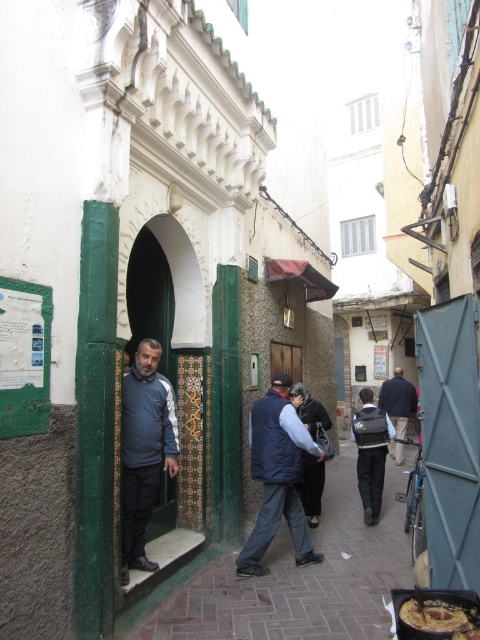
Question: Estimate the real-world distances between objects in this image. Which object is farther from the matte blue jacket at center?

Choices:
 (A) brick pavement at center
 (B) blue down vest at center

Answer: (A)

Question: Which object is the farthest from the dark blue jacket at center?

Choices:
 (A) brick pavement at center
 (B) matte blue jacket at center
 (C) blue down vest at center

Answer: (A)

Question: Observing the image, what is the correct spatial positioning of matte blue jacket at center in reference to dark blue jacket at center?

Choices:
 (A) left
 (B) right

Answer: (A)

Question: Does matte blue jacket at center appear over shiny brown bread at center?

Choices:
 (A) no
 (B) yes

Answer: (B)

Question: Which point is farther to the camera?

Choices:
 (A) (402, 408)
 (B) (385, 588)
 (C) (154, 406)
 (D) (454, 620)

Answer: (A)

Question: Considering the relative positions of brick pavement at center and blue down vest at center in the image provided, where is brick pavement at center located with respect to blue down vest at center?

Choices:
 (A) below
 (B) above

Answer: (A)